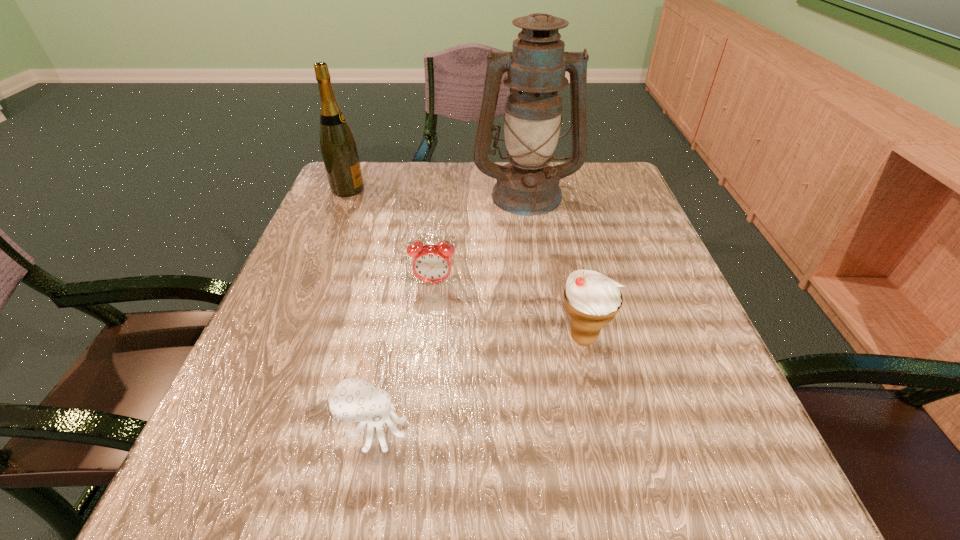
The image size is (960, 540). In order to click on vacant space at the far edge in this screenshot , I will do `click(443, 170)`.

In the image, there is a desktop. Identify the location of vacant space at the near edge. (607, 503).

Locate an element on the screen. This screenshot has width=960, height=540. vacant region at the left edge is located at coordinates (260, 350).

In the image, there is a desktop. Where is `vacant space at the far left corner`? vacant space at the far left corner is located at coordinates (373, 187).

In the image, there is a desktop. Identify the location of vacant region at the far right corner. (575, 178).

This screenshot has width=960, height=540. In the image, there is a desktop. What are the coordinates of `vacant space at the near right corner` in the screenshot? It's located at (674, 464).

At what (x,y) coordinates should I click in order to perform the action: click on vacant space in between the alarm clock and the oil lamp. Please return your answer as a coordinate pair (x, y). Image resolution: width=960 pixels, height=540 pixels. Looking at the image, I should click on (480, 238).

Where is `vacant area that lies between the second nearest object and the nearest object`? Image resolution: width=960 pixels, height=540 pixels. vacant area that lies between the second nearest object and the nearest object is located at coordinates (479, 383).

The height and width of the screenshot is (540, 960). I want to click on empty space that is in between the octopus and the oil lamp, so click(450, 312).

At what (x,y) coordinates should I click in order to perform the action: click on unoccupied area between the wine bottle and the second nearest object. Please return your answer as a coordinate pair (x, y). The image size is (960, 540). Looking at the image, I should click on (466, 264).